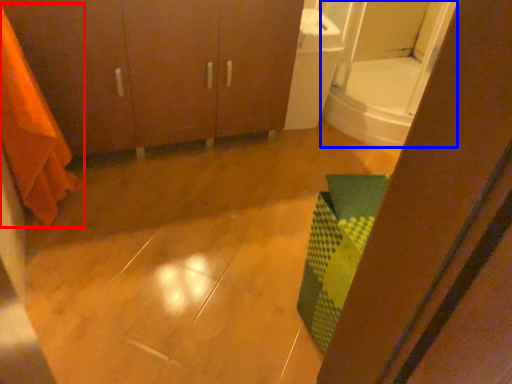
Question: Which object is further to the camera taking this photo, shower curtain (highlighted by a red box) or mirror (highlighted by a blue box)?

Choices:
 (A) shower curtain
 (B) mirror

Answer: (B)